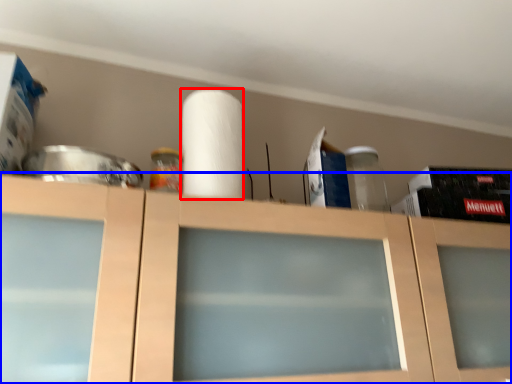
Question: Which point is closer to the camera, paper towel (highlighted by a red box) or cabinetry (highlighted by a blue box)?

Choices:
 (A) paper towel
 (B) cabinetry

Answer: (B)